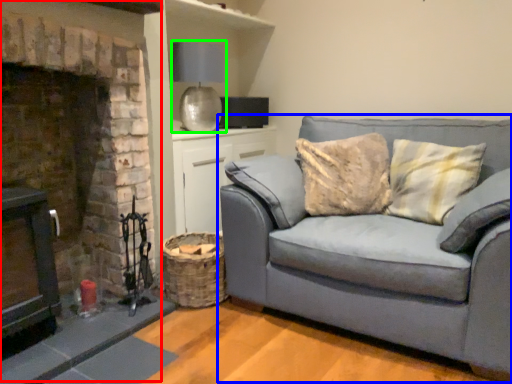
Question: Estimate the real-world distances between objects in this image. Which object is closer to fireplace (highlighted by a red box), studio couch (highlighted by a blue box) or lamp (highlighted by a green box)?

Choices:
 (A) studio couch
 (B) lamp

Answer: (B)